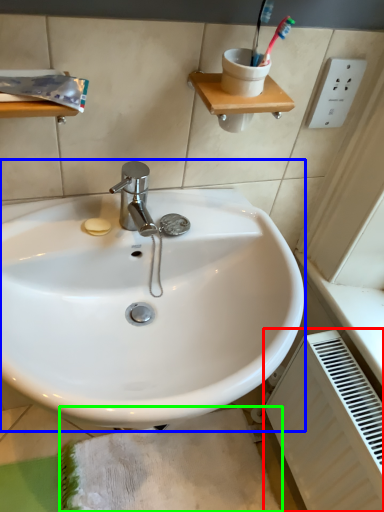
Question: Estimate the real-world distances between objects in this image. Which object is closer to radiator (highlighted by a red box), sink (highlighted by a blue box) or bath mat (highlighted by a green box)?

Choices:
 (A) sink
 (B) bath mat

Answer: (B)